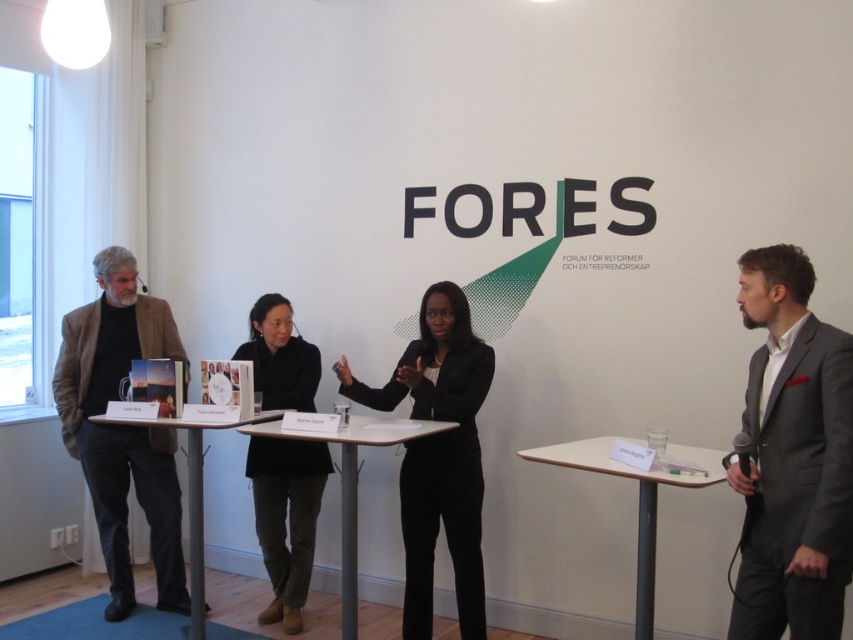
You are at the Fores forum event and want to take a photo of both the point at coordinates (462,385) and the point at coordinates (311,358). Which point should you focus on first to ensure both are in clear view?

You should focus on the point at coordinates (462,385) first since it is closer to the camera than the point at coordinates (311,358). This ensures that both points will be in focus when taking the photo.

You are attending the Fores forum event and notice a speaker wearing a gray suit at right. Where exactly is this speaker located in the room?

The gray suit at right is located at point (792, 458) in the room.

You are organizing a photo shoot and need to ensure that the black matte suit at center and the wooden table at center are both visible in the frame. Given their sizes, which object should you prioritize positioning closer to the camera to ensure both are fully visible?

The black matte suit at center occupies less space than the wooden table at center, so you should prioritize positioning the wooden table at center closer to the camera to ensure both are fully visible.